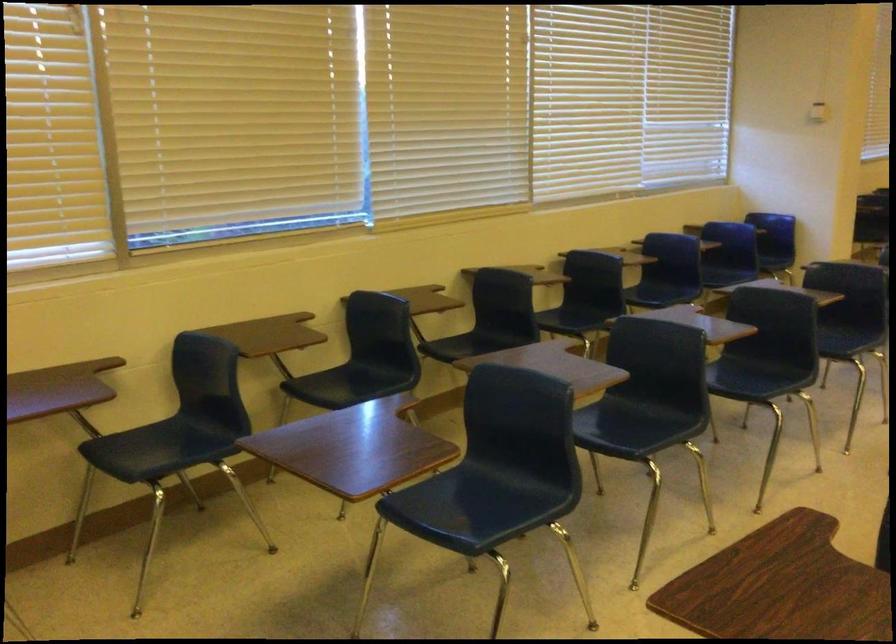
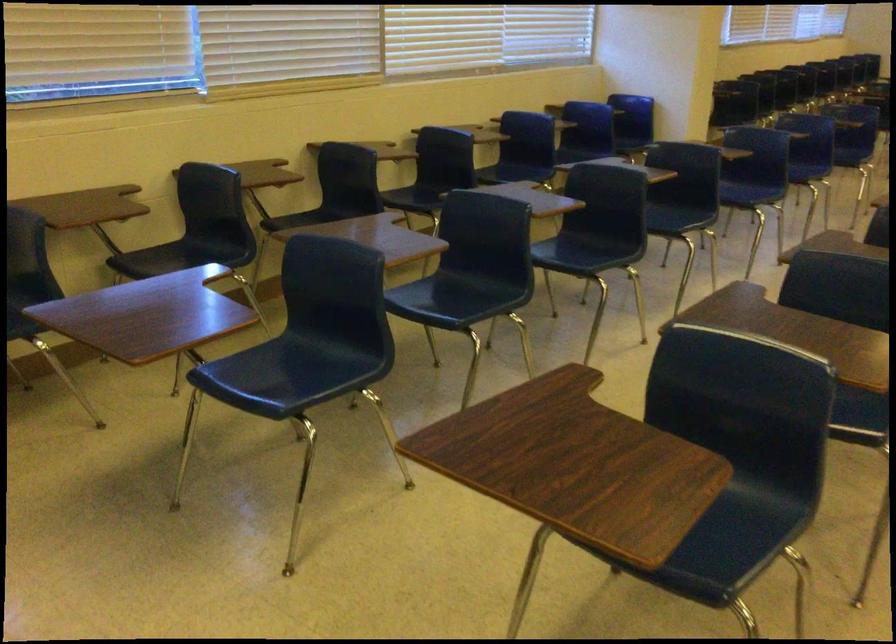
Question: The images are taken continuously from a first-person perspective. In which direction are you moving?

Choices:
 (A) Left
 (B) Right
 (C) Forward
 (D) Backward

Answer: (B)